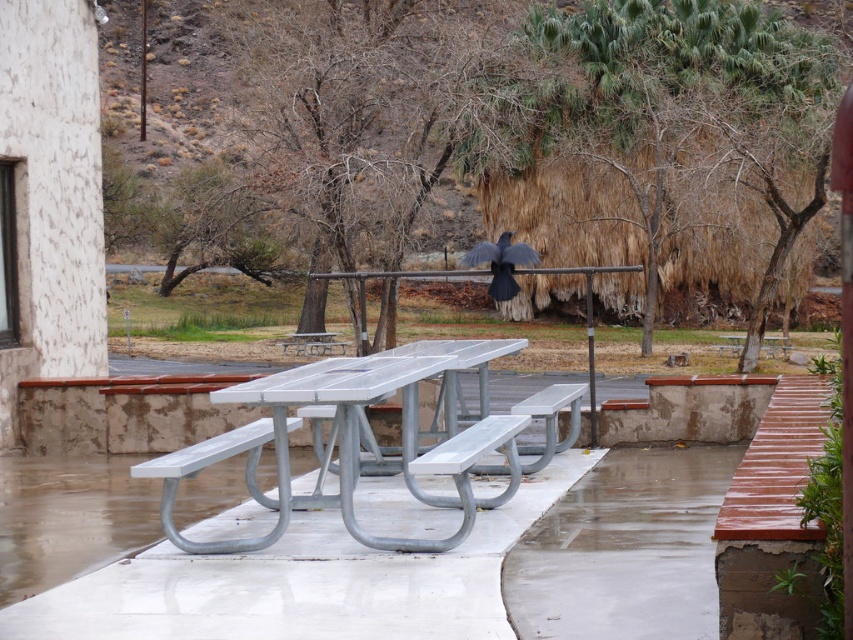
Question: Considering the relative positions of metallic silver picnic table at center and metallic silver bench at center in the image provided, where is metallic silver picnic table at center located with respect to metallic silver bench at center?

Choices:
 (A) below
 (B) above

Answer: (B)

Question: Among these points, which one is nearest to the camera?

Choices:
 (A) (413, 444)
 (B) (549, 417)

Answer: (A)

Question: Is metallic silver picnic table at center to the left of metallic silver bench at center from the viewer's perspective?

Choices:
 (A) no
 (B) yes

Answer: (B)

Question: Which point is farther to the camera?

Choices:
 (A) metallic silver bench at center
 (B) metallic silver picnic table at center

Answer: (A)

Question: Can you confirm if metallic silver picnic table at center is smaller than metallic silver bench at center?

Choices:
 (A) no
 (B) yes

Answer: (A)